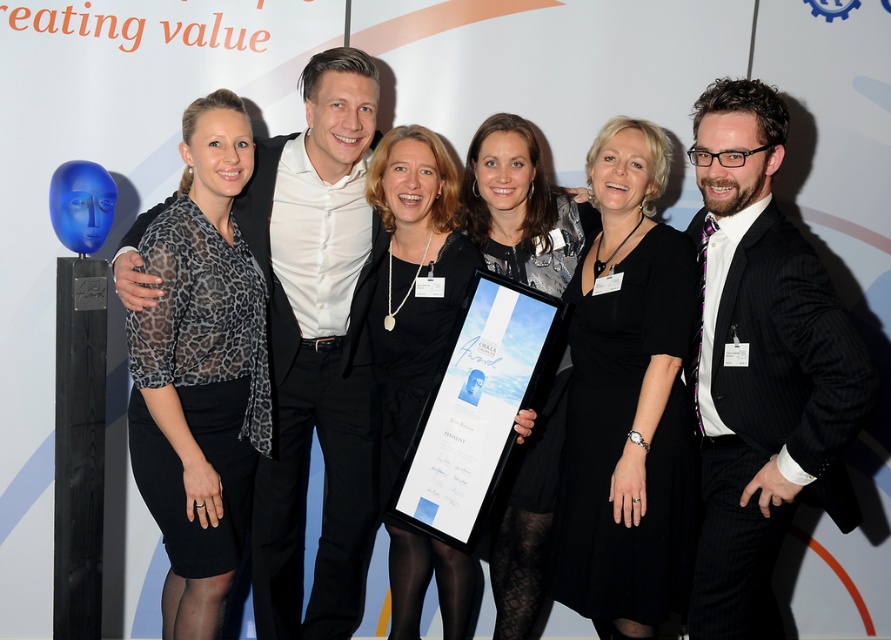
Is black satin dress at center smaller than matte black dress at center?

No, black satin dress at center is not smaller than matte black dress at center.

What do you see at coordinates (413, 282) in the screenshot? I see `black satin dress at center` at bounding box center [413, 282].

Locate an element on the screen. Image resolution: width=891 pixels, height=640 pixels. black satin dress at center is located at coordinates (413, 282).

Is black pinstripe suit at center positioned before black satin dress at center?

That is True.

I want to click on black pinstripe suit at center, so click(761, 365).

Where is `black pinstripe suit at center`? The image size is (891, 640). black pinstripe suit at center is located at coordinates (761, 365).

Is point (240, 448) less distant than point (544, 540)?

Yes, it is in front of point (544, 540).

Can you confirm if black sheer blouse at left is positioned to the left of matte black dress at center?

Indeed, black sheer blouse at left is positioned on the left side of matte black dress at center.

Identify the location of black sheer blouse at left. This screenshot has width=891, height=640. (200, 371).